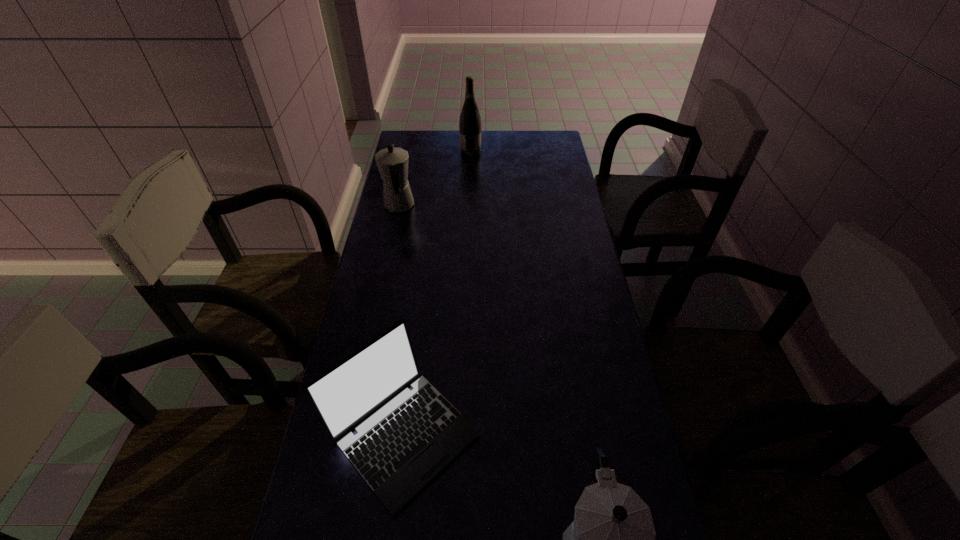
The width and height of the screenshot is (960, 540). In order to click on the tallest object in this screenshot , I will do `click(470, 122)`.

Identify the location of wine bottle. (470, 122).

Identify the location of the second farthest object. This screenshot has width=960, height=540. (392, 162).

The image size is (960, 540). I want to click on the farther coffeepot, so (x=392, y=162).

This screenshot has width=960, height=540. What are the coordinates of `laptop_computer` in the screenshot? It's located at (404, 438).

This screenshot has height=540, width=960. I want to click on free space located 0.330m on the label of the wine bottle, so click(557, 151).

You are a GUI agent. You are given a task and a screenshot of the screen. Output one action in this format:
    pyautogui.click(x=<x>, y=<y>)
    Task: Click on the free space located on the back of the farther coffeepot
    
    Given the screenshot: What is the action you would take?
    pyautogui.click(x=405, y=174)

What are the coordinates of `object present at the far edge` in the screenshot? It's located at (470, 122).

Find the location of a particular element. Image resolution: width=960 pixels, height=540 pixels. coffeepot at the left edge is located at coordinates (392, 162).

You are a GUI agent. You are given a task and a screenshot of the screen. Output one action in this format:
    pyautogui.click(x=<x>, y=<y>)
    Task: Click on the laptop_computer that is at the left edge
    The height and width of the screenshot is (540, 960).
    Given the screenshot: What is the action you would take?
    pyautogui.click(x=404, y=438)